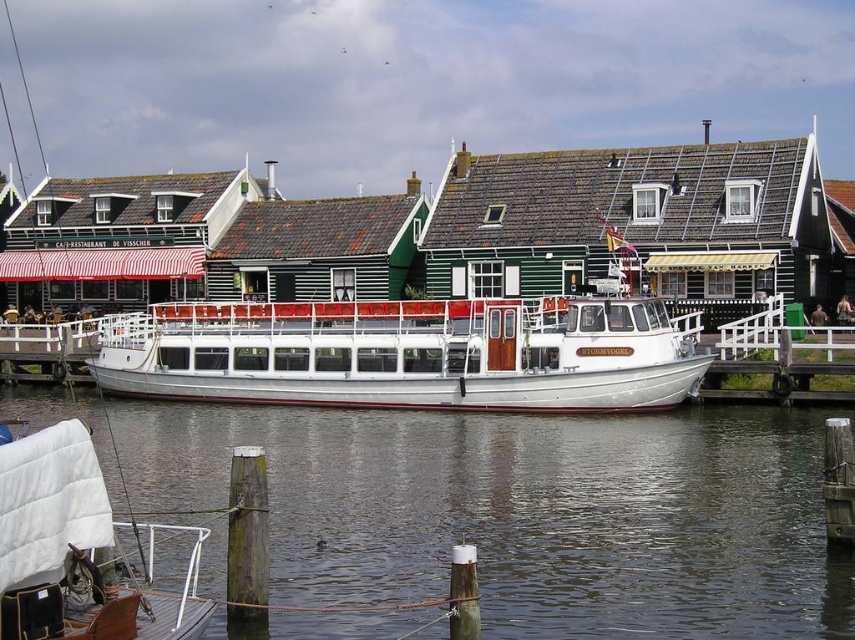
Does clear water at lower center appear under white polished wood boat at center?

Yes.

Can you confirm if clear water at lower center is smaller than white polished wood boat at center?

Actually, clear water at lower center might be larger than white polished wood boat at center.

At what (x,y) coordinates should I click in order to perform the action: click on clear water at lower center. Please return your answer as a coordinate pair (x, y). This screenshot has height=640, width=855. Looking at the image, I should click on (526, 513).